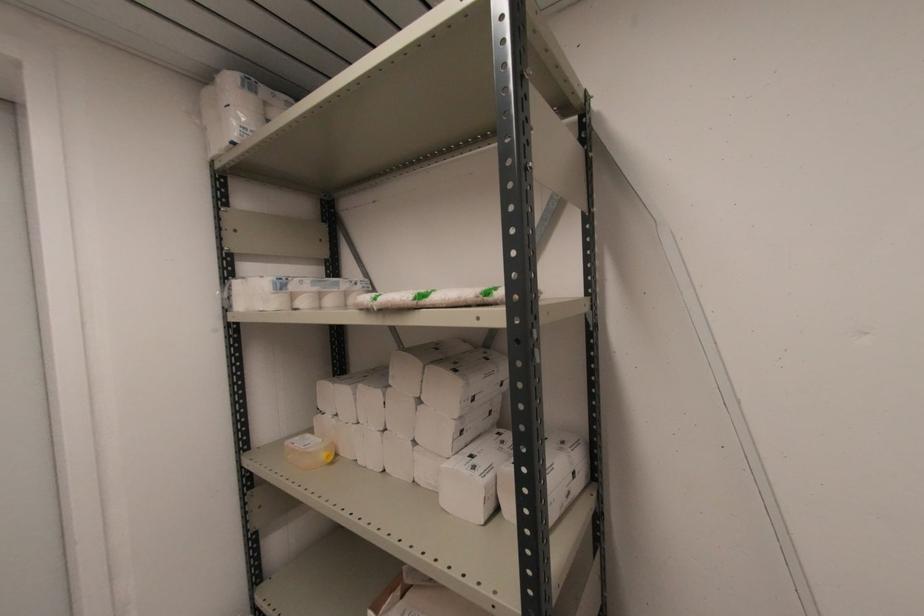
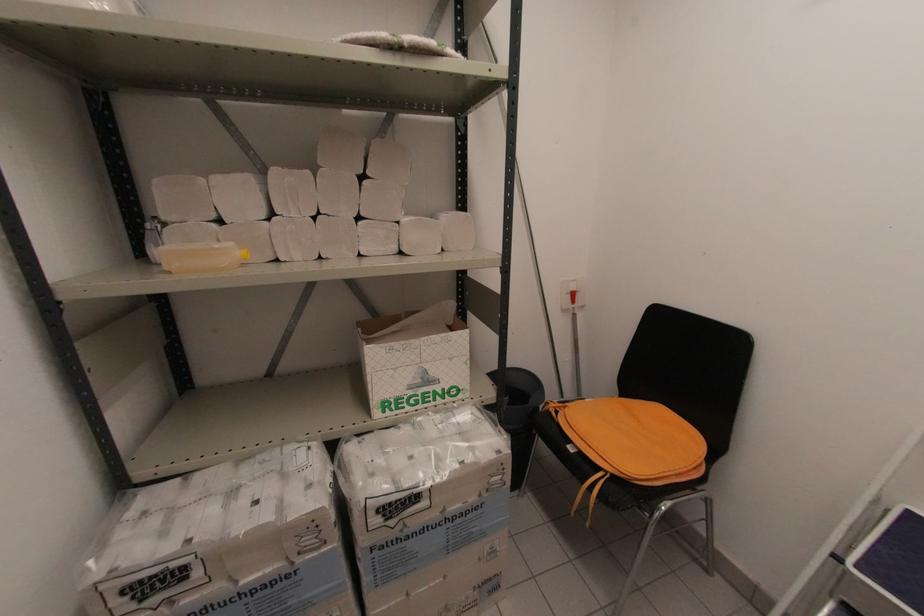
Question: The first image is from the beginning of the video and the second image is from the end. How did the camera likely rotate when shooting the video?

Choices:
 (A) Left
 (B) Right
 (C) Up
 (D) Down

Answer: (B)